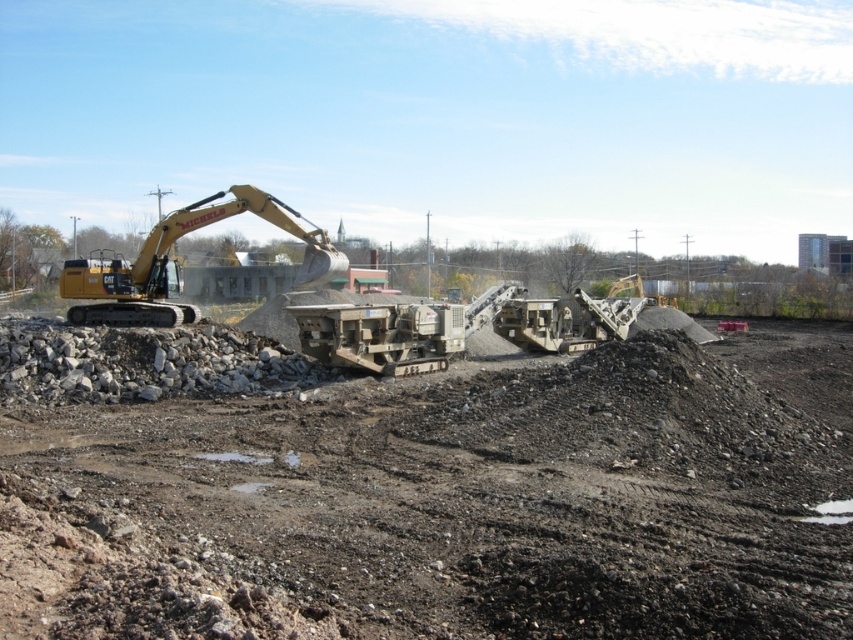
You are a construction worker standing at the edge of the construction site. You need to place a new safety sign at the exact center of the dull brown soil at center. According to the coordinates provided, where should you place the safety sign?

The safety sign should be placed at the 2D location coordinates of point (448, 502), which is the exact center of the dull brown soil at center.